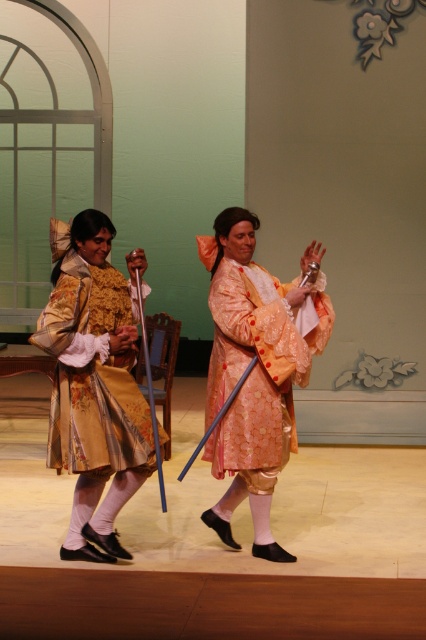
You are a stagehand preparing to adjust the lighting for the performance. The gold brocade dress at center and the matte peach robe at center are both at the center of the stage. Which costume will cast a longer shadow if the light source is positioned above them?

The gold brocade dress at center has a greater height compared to the matte peach robe at center, so it will cast a longer shadow.

You are an audience member sitting in the front row of the theater. You notice two main characters wearing the gold brocade dress at center and the matte peach robe at center. Which character is positioned to the left side of the stage?

The gold brocade dress at center is positioned to the left of the matte peach robe at center, so the character wearing the gold brocade dress at center is on the left side of the stage.